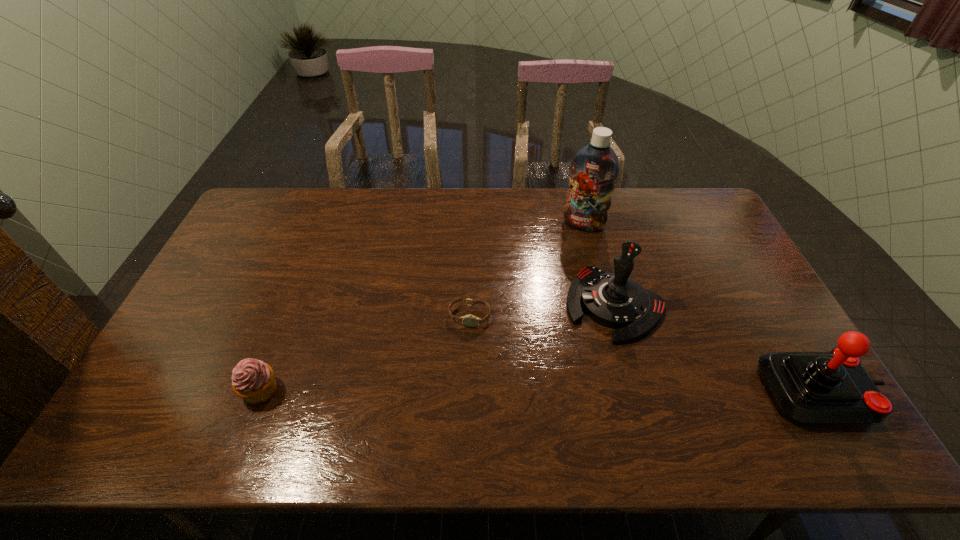
At what (x,y) coordinates should I click in order to perform the action: click on free spot between the farther joystick and the tallest object. Please return your answer as a coordinate pair (x, y). Looking at the image, I should click on (599, 264).

Image resolution: width=960 pixels, height=540 pixels. I want to click on vacant area between the shortest object and the nearer joystick, so click(644, 354).

Locate an element on the screen. Image resolution: width=960 pixels, height=540 pixels. free space between the second object from left to right and the second shortest object is located at coordinates (365, 353).

Find the location of a particular element. This screenshot has width=960, height=540. vacant space in between the right joystick and the leftmost object is located at coordinates (539, 391).

Locate an element on the screen. The image size is (960, 540). vacant area that lies between the farther joystick and the rightmost object is located at coordinates tap(716, 348).

Where is `empty space that is in between the shampoo and the cupcake`? empty space that is in between the shampoo and the cupcake is located at coordinates (421, 307).

Locate an element on the screen. Image resolution: width=960 pixels, height=540 pixels. unoccupied position between the farther joystick and the cupcake is located at coordinates (438, 347).

What are the coordinates of `free space between the watch and the rightmost object` in the screenshot? It's located at (644, 354).

The height and width of the screenshot is (540, 960). What are the coordinates of `free spot between the rightmost object and the tallest object` in the screenshot? It's located at (701, 308).

Where is `vacant area that lies between the cupcake and the shortest object`? The image size is (960, 540). vacant area that lies between the cupcake and the shortest object is located at coordinates (365, 353).